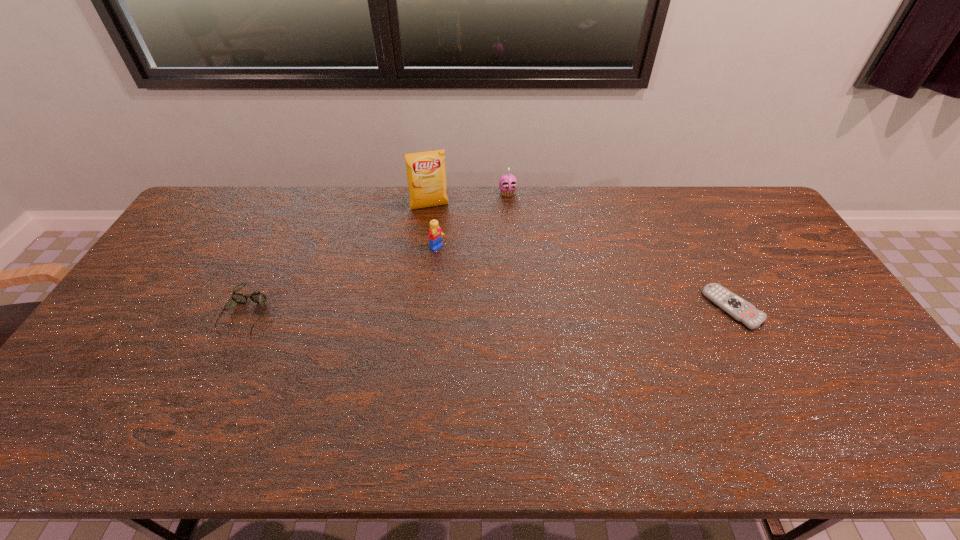
The height and width of the screenshot is (540, 960). Find the location of `vacant area situated 0.230m on the back of the shortest object`. vacant area situated 0.230m on the back of the shortest object is located at coordinates [x=696, y=236].

Identify the location of vacant space located on the front of the crisp (potato chip) with the logo. (437, 223).

Image resolution: width=960 pixels, height=540 pixels. I want to click on vacant region located on the front of the crisp (potato chip) with the logo, so click(x=436, y=221).

Find the location of a particular element. free space located 0.120m on the front of the crisp (potato chip) with the logo is located at coordinates (440, 234).

Where is `free space located on the face of the second object from right to left`? This screenshot has width=960, height=540. free space located on the face of the second object from right to left is located at coordinates (513, 212).

Locate an element on the screen. Image resolution: width=960 pixels, height=540 pixels. vacant space situated 0.340m on the face of the second object from right to left is located at coordinates (528, 262).

Where is `vacant area situated 0.370m on the face of the second object from right to left`? This screenshot has width=960, height=540. vacant area situated 0.370m on the face of the second object from right to left is located at coordinates (530, 269).

The image size is (960, 540). What are the coordinates of `free point located on the face of the Lego` in the screenshot? It's located at (506, 301).

This screenshot has height=540, width=960. In order to click on vacant point located on the face of the Lego in this screenshot , I will do `click(468, 273)`.

Identify the location of free space located on the face of the Lego. (455, 263).